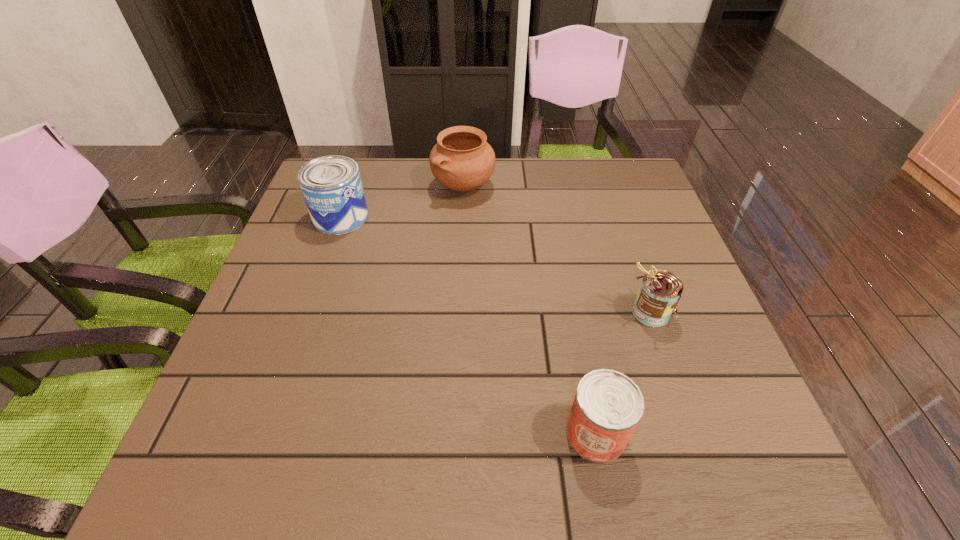
You are a GUI agent. You are given a task and a screenshot of the screen. Output one action in this format:
    pyautogui.click(x=<x>, y=<y>)
    Task: Click on the free space located on the back of the third object from left to right
    
    Given the screenshot: What is the action you would take?
    pyautogui.click(x=562, y=253)

The image size is (960, 540). What are the coordinates of `pottery situated at the far edge` in the screenshot? It's located at (462, 160).

I want to click on can that is at the far edge, so click(331, 185).

You are a GUI agent. You are given a task and a screenshot of the screen. Output one action in this format:
    pyautogui.click(x=<x>, y=<y>)
    Task: Click on the object that is at the near edge
    The width and height of the screenshot is (960, 540).
    Given the screenshot: What is the action you would take?
    pyautogui.click(x=608, y=405)

Locate an element on the screen. This screenshot has height=540, width=960. object at the left edge is located at coordinates [331, 185].

Find the location of a particular element. This screenshot has width=960, height=540. object at the right edge is located at coordinates 660,291.

Locate an element on the screen. This screenshot has width=960, height=540. object situated at the far left corner is located at coordinates (331, 185).

Identify the location of free location at the far edge. This screenshot has height=540, width=960. coord(573,179).

This screenshot has height=540, width=960. In order to click on free location at the near edge of the desktop in this screenshot , I will do `click(581, 482)`.

I want to click on vacant area at the left edge of the desktop, so click(295, 289).